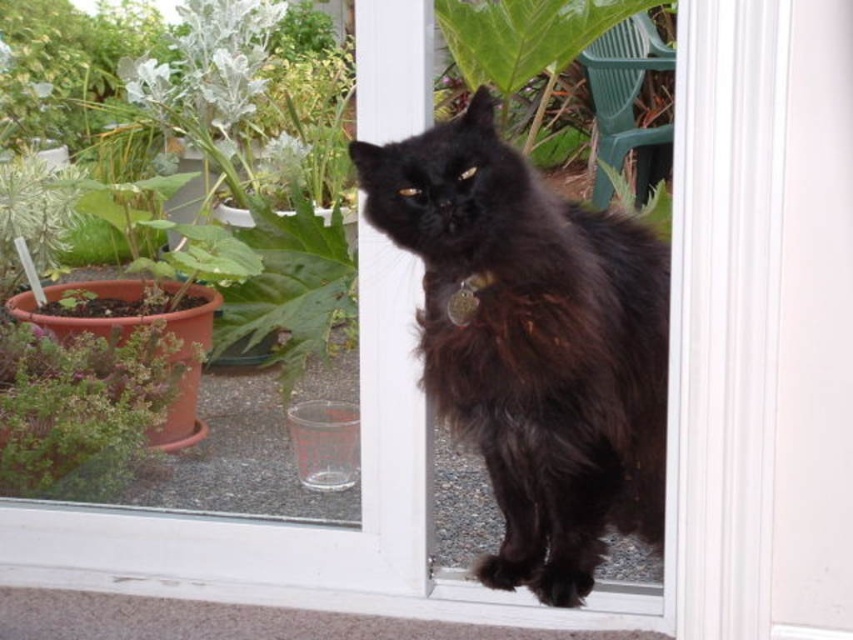
Can you confirm if white smooth screen door at center is shorter than black fluffy cat at center?

In fact, white smooth screen door at center may be taller than black fluffy cat at center.

Between white smooth screen door at center and black fluffy cat at center, which one appears on the left side from the viewer's perspective?

Positioned to the left is black fluffy cat at center.

Does point (750, 502) come behind point (611, 461)?

No, it is in front of (611, 461).

Identify the location of white smooth screen door at center. This screenshot has width=853, height=640. (762, 321).

Between point (442, 381) and point (44, 461), which one is positioned behind?

The point (44, 461) is more distant.

Which is behind, point (540, 227) or point (74, 376)?

The point (74, 376) is behind.

Find the location of a particular element. Image resolution: width=853 pixels, height=640 pixels. black fluffy cat at center is located at coordinates (534, 344).

Is point (840, 131) closer to viewer compared to point (45, 451)?

Yes, point (840, 131) is in front of point (45, 451).

Does white smooth screen door at center have a larger size compared to green matte plant at left?

Yes.

Who is more forward, (747, 72) or (151, 388)?

Point (747, 72) is more forward.

I want to click on white smooth screen door at center, so click(762, 321).